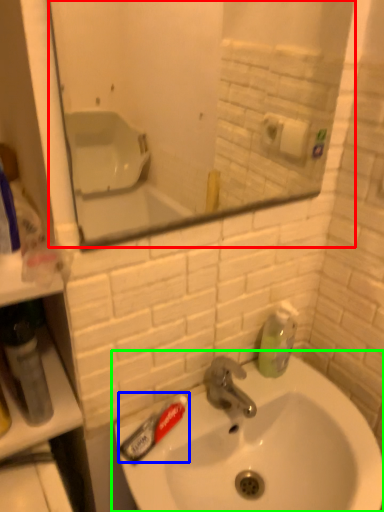
Question: Which object is the farthest from mirror (highlighted by a red box)? Choose among these: toothpaste (highlighted by a blue box) or sink (highlighted by a green box).

Choices:
 (A) toothpaste
 (B) sink

Answer: (A)